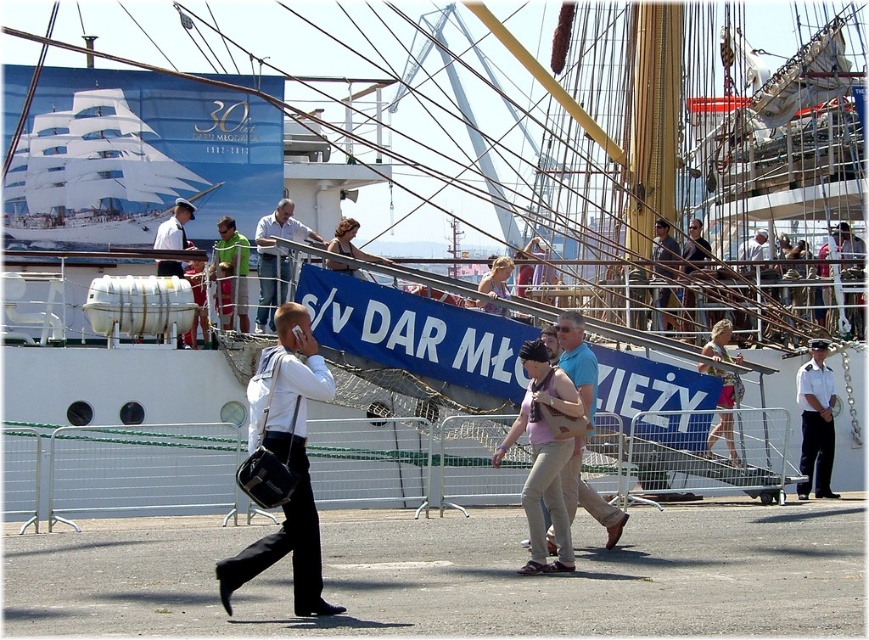
Is white matte helmet at center bigger than matte black hair at center?

Yes.

Is point (168, 266) closer to viewer compared to point (324, 262)?

No, it is behind (324, 262).

Where is `white matte helmet at center`? The image size is (869, 640). white matte helmet at center is located at coordinates (174, 227).

Does point (728, 420) lie behind point (687, 240)?

No, (728, 420) is closer to viewer.

Is matte pink shorts at center positioned behind light brown leather jacket at upper center?

That is False.

Is point (722, 416) closer to viewer compared to point (700, 246)?

That is True.

Where is `matte pink shorts at center`? matte pink shorts at center is located at coordinates (720, 342).

Is green fabric shirt at center to the left of matte pink shorts at center from the viewer's perspective?

Yes, green fabric shirt at center is to the left of matte pink shorts at center.

Between green fabric shirt at center and matte pink shorts at center, which one appears on the left side from the viewer's perspective?

green fabric shirt at center is more to the left.

Measure the distance between green fabric shirt at center and camera.

A distance of 231.36 feet exists between green fabric shirt at center and camera.

At what (x,y) coordinates should I click in order to perform the action: click on green fabric shirt at center. Please return your answer as a coordinate pair (x, y). The image size is (869, 640). Looking at the image, I should click on (231, 273).